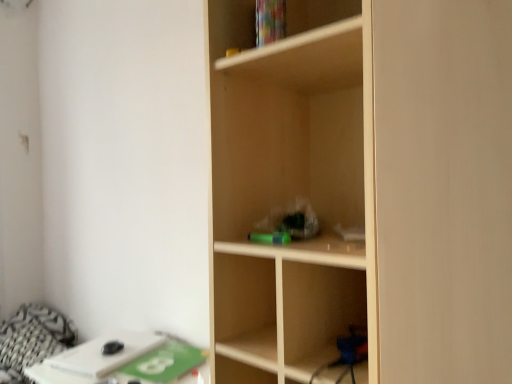
Identify the location of light wood shelf at center. (366, 188).

Describe the element at coordinates (165, 362) in the screenshot. I see `green matte paperback book at lower left` at that location.

Image resolution: width=512 pixels, height=384 pixels. I want to click on white matte table at lower left, so click(x=122, y=361).

This screenshot has width=512, height=384. I want to click on light wood shelf at center, so 366,188.

Which point is more distant from viewer, (454, 282) or (153, 363)?

The point (153, 363) is farther from the camera.

From a real-world perspective, is light wood shelf at center above or below white matte table at lower left?

light wood shelf at center is above white matte table at lower left.

Consider the image. Is light wood shelf at center bigger than white matte table at lower left?

Indeed, light wood shelf at center has a larger size compared to white matte table at lower left.

Which object is wider, light wood shelf at center or white matte table at lower left?

With larger width is light wood shelf at center.

Does white matte table at lower left contain patterned fabric bedding at lower left?

Actually, patterned fabric bedding at lower left is outside white matte table at lower left.

Which of these two, white matte table at lower left or patterned fabric bedding at lower left, stands taller?

Standing taller between the two is patterned fabric bedding at lower left.

Is white matte table at lower left at the right side of patterned fabric bedding at lower left?

Yes, white matte table at lower left is to the right of patterned fabric bedding at lower left.

Is white matte table at lower left oriented away from patterned fabric bedding at lower left?

That's not correct — white matte table at lower left is not looking away from patterned fabric bedding at lower left.

Which is more to the left, light wood shelf at center or patterned fabric bedding at lower left?

Positioned to the left is patterned fabric bedding at lower left.

How distant is light wood shelf at center from patterned fabric bedding at lower left?

They are 1.60 meters apart.

Is light wood shelf at center oriented towards patterned fabric bedding at lower left?

No, light wood shelf at center is not oriented towards patterned fabric bedding at lower left.

From the image's perspective, which is above, light wood shelf at center or patterned fabric bedding at lower left?

light wood shelf at center.

Is light wood shelf at center to the right of green matte paperback book at lower left from the viewer's perspective?

Correct, you'll find light wood shelf at center to the right of green matte paperback book at lower left.

From the image's perspective, does light wood shelf at center appear higher than green matte paperback book at lower left?

Yes, from the image's perspective, light wood shelf at center is above green matte paperback book at lower left.

Considering the points (486, 127) and (172, 340), which point is behind, point (486, 127) or point (172, 340)?

The point (172, 340) is more distant.

Between light wood shelf at center and green matte paperback book at lower left, which one has more height?

With more height is light wood shelf at center.

Is patterned fabric bedding at lower left touching light wood shelf at center?

patterned fabric bedding at lower left and light wood shelf at center are not in contact.

Considering the relative sizes of patterned fabric bedding at lower left and light wood shelf at center in the image provided, is patterned fabric bedding at lower left thinner than light wood shelf at center?

In fact, patterned fabric bedding at lower left might be wider than light wood shelf at center.

Is patterned fabric bedding at lower left taller than light wood shelf at center?

No.

Which is more to the left, patterned fabric bedding at lower left or light wood shelf at center?

Positioned to the left is patterned fabric bedding at lower left.

Between green matte paperback book at lower left and white matte table at lower left, which one has more height?

With more height is green matte paperback book at lower left.

From the image's perspective, is green matte paperback book at lower left located beneath white matte table at lower left?

Correct, green matte paperback book at lower left appears lower than white matte table at lower left in the image.

Considering the relative sizes of green matte paperback book at lower left and white matte table at lower left in the image provided, is green matte paperback book at lower left bigger than white matte table at lower left?

Actually, green matte paperback book at lower left might be smaller than white matte table at lower left.

Is green matte paperback book at lower left wider than white matte table at lower left?

In fact, green matte paperback book at lower left might be narrower than white matte table at lower left.

From the image's perspective, which is above, white matte table at lower left or light wood shelf at center?

From the image's view, light wood shelf at center is above.

Measure the distance from white matte table at lower left to light wood shelf at center.

white matte table at lower left is 34.38 inches away from light wood shelf at center.

Considering the positions of point (60, 359) and point (352, 303), is point (60, 359) closer or farther from the camera than point (352, 303)?

Point (60, 359) is farther from the camera than point (352, 303).

Which is more to the right, white matte table at lower left or light wood shelf at center?

light wood shelf at center is more to the right.

Identify the location of shelf lying on the right of white matte table at lower left. (366, 188).

Locate an element on the screen. The image size is (512, 384). table located above the patterned fabric bedding at lower left (from a real-world perspective) is located at coordinates (122, 361).

Considering their positions, is patterned fabric bedding at lower left positioned further to green matte paperback book at lower left than white matte table at lower left?

patterned fabric bedding at lower left is further to green matte paperback book at lower left.

Based on their spatial positions, is patterned fabric bedding at lower left or green matte paperback book at lower left closer to light wood shelf at center?

The object closer to light wood shelf at center is green matte paperback book at lower left.

Considering their positions, is light wood shelf at center positioned closer to patterned fabric bedding at lower left than green matte paperback book at lower left?

Based on the image, green matte paperback book at lower left appears to be nearer to patterned fabric bedding at lower left.

From the image, which object appears to be farther from patterned fabric bedding at lower left, green matte paperback book at lower left or light wood shelf at center?

light wood shelf at center is positioned further to the anchor patterned fabric bedding at lower left.

Considering their positions, is patterned fabric bedding at lower left positioned closer to white matte table at lower left than light wood shelf at center?

Among the two, patterned fabric bedding at lower left is located nearer to white matte table at lower left.

Considering their positions, is light wood shelf at center positioned further to white matte table at lower left than patterned fabric bedding at lower left?

The object further to white matte table at lower left is light wood shelf at center.

From the image, which object appears to be nearer to patterned fabric bedding at lower left, white matte table at lower left or green matte paperback book at lower left?

white matte table at lower left is closer to patterned fabric bedding at lower left.

Looking at the image, which one is located closer to white matte table at lower left, patterned fabric bedding at lower left or green matte paperback book at lower left?

green matte paperback book at lower left.

Identify the location of paperback book located between patterned fabric bedding at lower left and light wood shelf at center in the left-right direction. (165, 362).

Where is `table between patterned fabric bedding at lower left and light wood shelf at center`? The height and width of the screenshot is (384, 512). table between patterned fabric bedding at lower left and light wood shelf at center is located at coordinates (122, 361).

I want to click on paperback book between light wood shelf at center and white matte table at lower left from front to back, so click(165, 362).

You are a GUI agent. You are given a task and a screenshot of the screen. Output one action in this format:
    pyautogui.click(x=<x>, y=<y>)
    Task: Click on the table between patterned fabric bedding at lower left and green matte paperback book at lower left in the horizontal direction
    Image resolution: width=512 pixels, height=384 pixels.
    Given the screenshot: What is the action you would take?
    pyautogui.click(x=122, y=361)